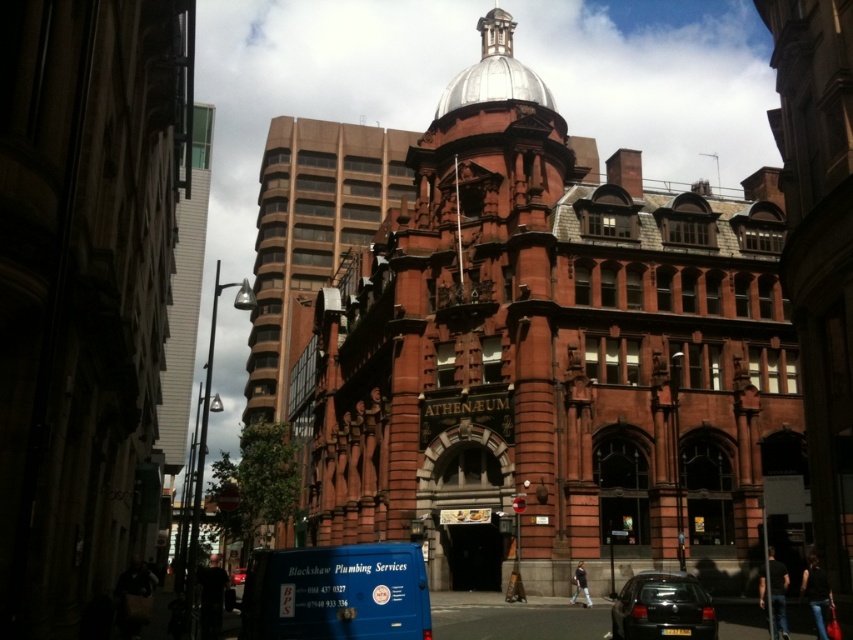
You are standing at the entrance of the ATHENAEUM building and want to take a photo of the white glass tower at upper left. Where should you position yourself to capture it in the frame?

The white glass tower at upper left is located at point (184, 298), so you should position yourself at the entrance of the ATHENAEUM building and aim your camera towards the upper left direction to capture it in the frame.

You are standing at the entrance of the ATHENAEUM building and want to walk to the blue van labeled Blackshaw Plumbing Services. According to the image, which direction should you head towards first? Please choose between moving towards point A or point B, where point A is point (669, 600) and point B is point (238, 566).

You should head towards point A first because point A is in front of point B, meaning it is closer to your current position at the entrance.

You are standing at the entrance of the ATHENAEUM building and want to take a photo of the shiny black car at lower right using a camera. The camera has a maximum range of 40 meters. Can you capture the car in your photo without moving from your current position?

The shiny black car at lower right and camera are 42.78 meters apart from each other. Since the camera has a maximum range of 40 meters, you cannot capture the car in your photo without moving from your current position.